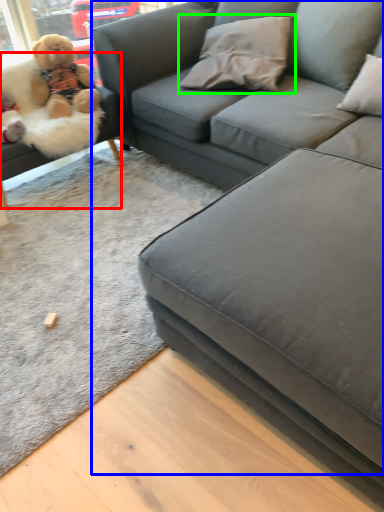
Question: Estimate the real-world distances between objects in this image. Which object is farther from studio couch (highlighted by a red box), studio couch (highlighted by a blue box) or pillow (highlighted by a green box)?

Choices:
 (A) studio couch
 (B) pillow

Answer: (A)